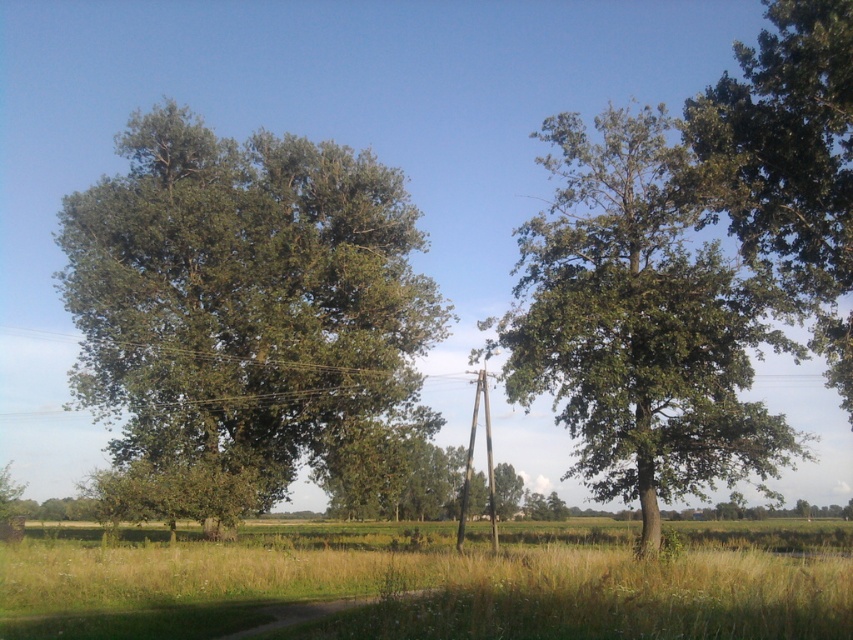
Which of these two, green leafy tree at left or green leafy tree at upper right, stands taller?

Standing taller between the two is green leafy tree at left.

Between green leafy tree at left and green leafy tree at upper right, which one appears on the right side from the viewer's perspective?

From the viewer's perspective, green leafy tree at upper right appears more on the right side.

Who is more forward, (190, 400) or (833, 227)?

Positioned in front is point (833, 227).

Where is `green leafy tree at left`? green leafy tree at left is located at coordinates (247, 320).

You are a GUI agent. You are given a task and a screenshot of the screen. Output one action in this format:
    pyautogui.click(x=<x>, y=<y>)
    Task: Click on the green leafy tree at upper right
    This screenshot has height=640, width=853.
    Given the screenshot: What is the action you would take?
    pyautogui.click(x=788, y=161)

Is green leafy tree at upper right wider than brown wooden telegraph pole at center?

Yes.

Does point (782, 35) come in front of point (471, 470)?

Yes, it is.

At what (x,y) coordinates should I click in order to perform the action: click on green leafy tree at upper right. Please return your answer as a coordinate pair (x, y). Image resolution: width=853 pixels, height=640 pixels. Looking at the image, I should click on pos(788,161).

Which is above, green grass at lower center or brown wooden telegraph pole at center?

brown wooden telegraph pole at center is higher up.

Between green grass at lower center and brown wooden telegraph pole at center, which one appears on the left side from the viewer's perspective?

Positioned to the left is green grass at lower center.

Between point (618, 636) and point (463, 488), which one is positioned in front?

Point (618, 636)

Where is `green grass at lower center`? The height and width of the screenshot is (640, 853). green grass at lower center is located at coordinates (430, 580).